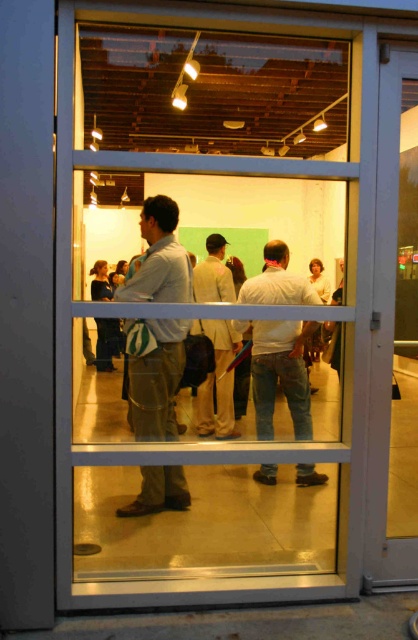
Question: Which object is farther from the camera taking this photo?

Choices:
 (A) white glossy door at right
 (B) white cotton shirt at center
 (C) light beige suit at center
 (D) light brown fabric shirt at center

Answer: (C)

Question: Which point appears farthest from the camera in this image?

Choices:
 (A) (265, 384)
 (B) (76, 470)

Answer: (B)

Question: Is clear glass door at center above light beige suit at center?

Choices:
 (A) no
 (B) yes

Answer: (B)

Question: Does clear glass door at center have a greater width compared to white glossy door at right?

Choices:
 (A) no
 (B) yes

Answer: (B)

Question: Which object is farther from the camera taking this photo?

Choices:
 (A) clear glass door at center
 (B) white glossy door at right
 (C) light brown fabric shirt at center
 (D) light beige suit at center

Answer: (D)

Question: Does clear glass door at center have a larger size compared to white cotton shirt at center?

Choices:
 (A) no
 (B) yes

Answer: (B)